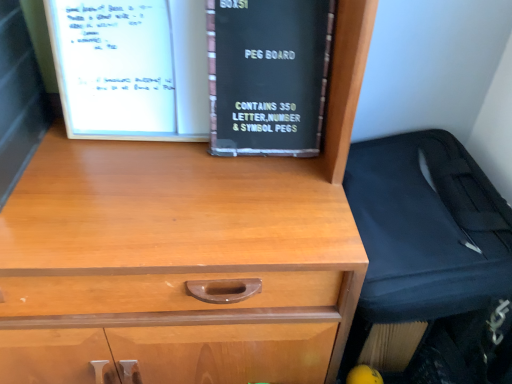
Question: Does black fabric suitcase at right have a lesser width compared to black cardboard box at center?

Choices:
 (A) no
 (B) yes

Answer: (A)

Question: Considering the relative sizes of black fabric suitcase at right and black cardboard box at center in the image provided, is black fabric suitcase at right shorter than black cardboard box at center?

Choices:
 (A) yes
 (B) no

Answer: (B)

Question: Considering the relative sizes of black fabric suitcase at right and black cardboard box at center in the image provided, is black fabric suitcase at right taller than black cardboard box at center?

Choices:
 (A) no
 (B) yes

Answer: (B)

Question: Would you say black cardboard box at center is part of black fabric suitcase at right's contents?

Choices:
 (A) no
 (B) yes

Answer: (A)

Question: Does black fabric suitcase at right have a larger size compared to black cardboard box at center?

Choices:
 (A) yes
 (B) no

Answer: (A)

Question: From the image's perspective, is black fabric suitcase at right under black cardboard box at center?

Choices:
 (A) yes
 (B) no

Answer: (A)

Question: From a real-world perspective, is black cardboard box at center positioned over black fabric suitcase at right based on gravity?

Choices:
 (A) yes
 (B) no

Answer: (A)

Question: Considering the relative positions of black cardboard box at center and black fabric suitcase at right in the image provided, is black cardboard box at center to the right of black fabric suitcase at right from the viewer's perspective?

Choices:
 (A) no
 (B) yes

Answer: (A)

Question: Does black cardboard box at center lie behind black fabric suitcase at right?

Choices:
 (A) yes
 (B) no

Answer: (A)

Question: From the image's perspective, is black cardboard box at center located above black fabric suitcase at right?

Choices:
 (A) no
 (B) yes

Answer: (B)

Question: Is black cardboard box at center taller than black fabric suitcase at right?

Choices:
 (A) yes
 (B) no

Answer: (B)

Question: Is black cardboard box at center facing towards black fabric suitcase at right?

Choices:
 (A) no
 (B) yes

Answer: (A)

Question: Is black cardboard box at center situated inside black fabric suitcase at right or outside?

Choices:
 (A) inside
 (B) outside

Answer: (B)